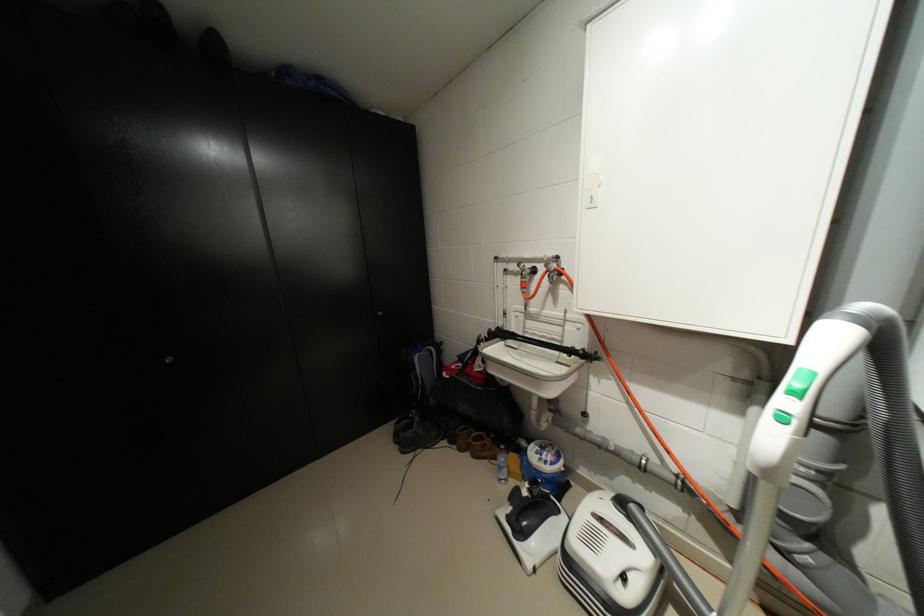
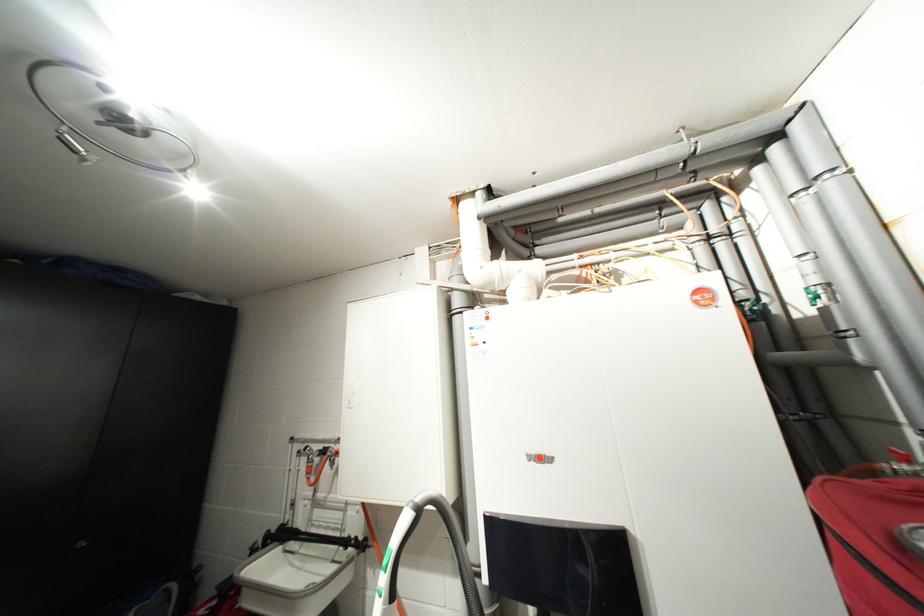
Based on the continuous images, in which direction is the camera rotating?

The camera's rotation is toward right-up.